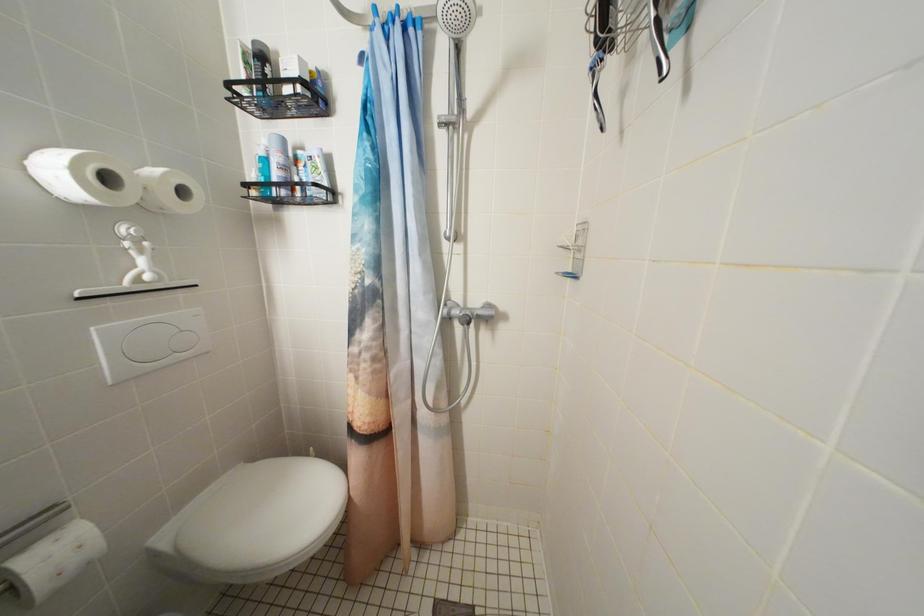
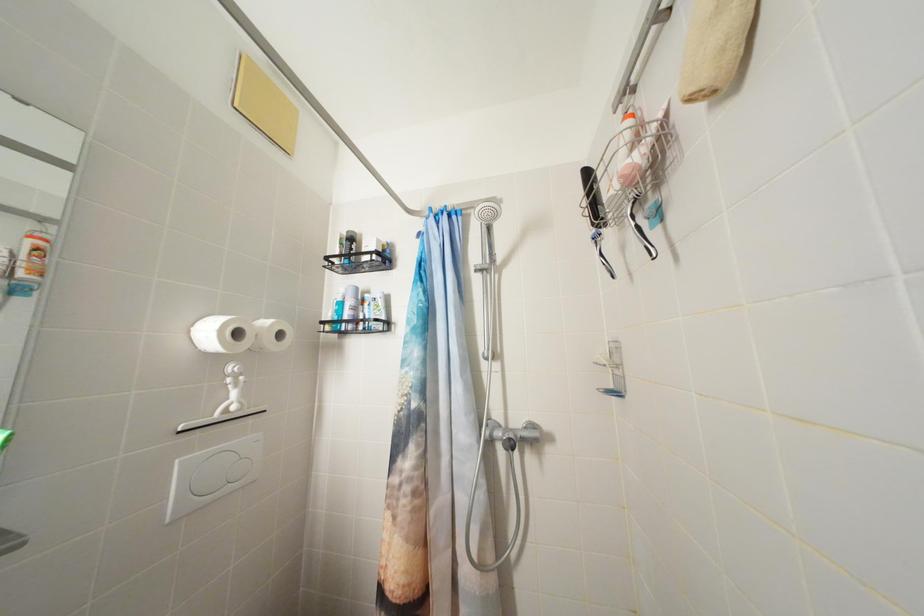
Question: How did the camera likely rotate?

Choices:
 (A) Left
 (B) Right
 (C) Up
 (D) Down

Answer: (C)